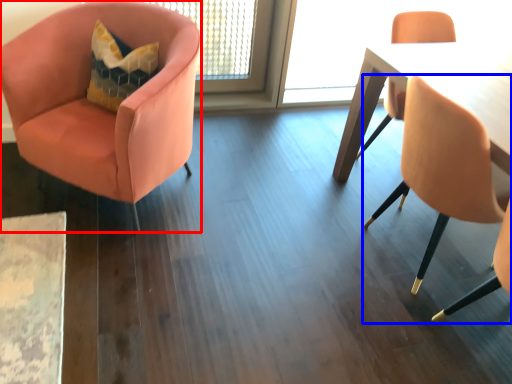
Question: Which point is closer to the camera, chair (highlighted by a red box) or chair (highlighted by a blue box)?

Choices:
 (A) chair
 (B) chair

Answer: (B)